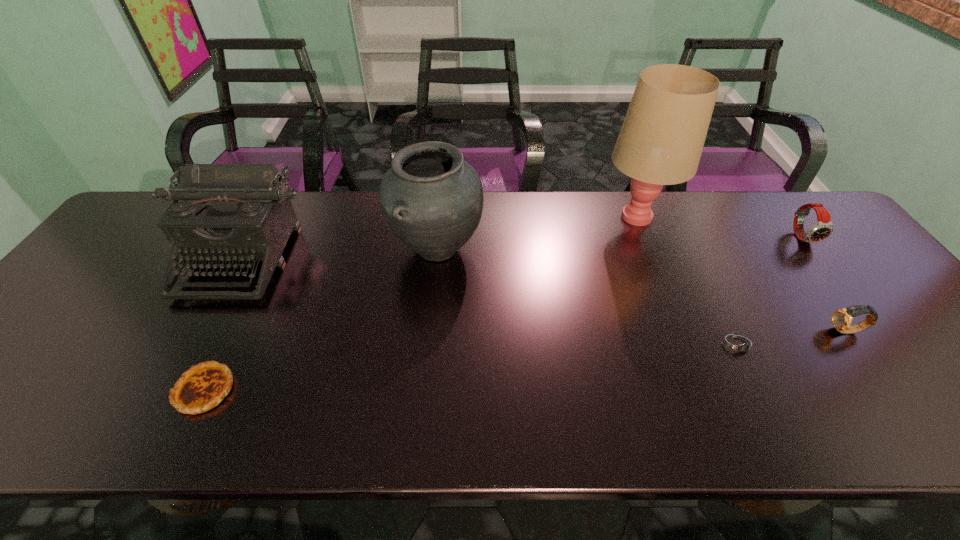
The image size is (960, 540). What are the coordinates of `lampshade` in the screenshot? It's located at (660, 143).

Locate an element on the screen. the second tallest object is located at coordinates (432, 199).

Identify the location of urn. (432, 199).

I want to click on typewriter, so click(x=226, y=212).

Locate an element on the screen. the fourth tallest object is located at coordinates (823, 228).

The image size is (960, 540). I want to click on the tallest watch, so click(823, 228).

The width and height of the screenshot is (960, 540). I want to click on the third shortest object, so click(x=841, y=319).

Where is `quiche`? Image resolution: width=960 pixels, height=540 pixels. quiche is located at coordinates (202, 387).

Where is `the shortest object`? Image resolution: width=960 pixels, height=540 pixels. the shortest object is located at coordinates (738, 344).

I want to click on the shortest watch, so click(x=738, y=344).